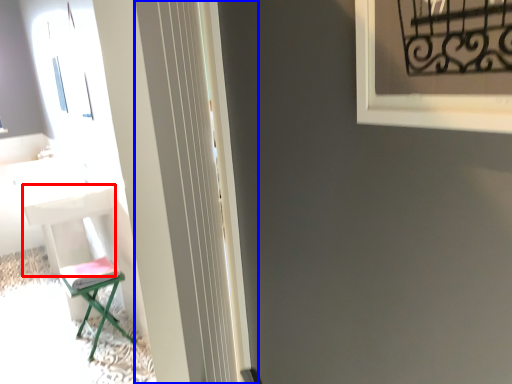
Question: Which object appears farthest to the camera in this image, table (highlighted by a red box) or screen door (highlighted by a blue box)?

Choices:
 (A) table
 (B) screen door

Answer: (A)